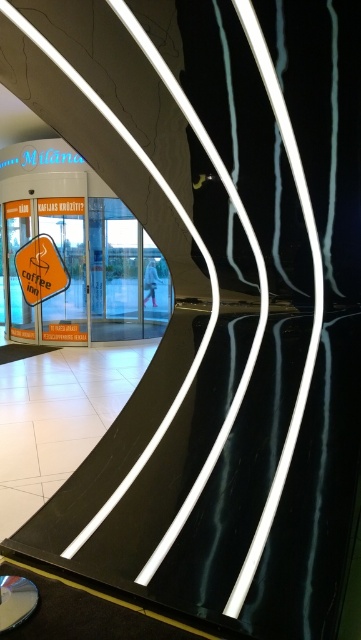
Between orange plastic sign at center and orange matte coffee sign at left, which one appears on the left side from the viewer's perspective?

orange matte coffee sign at left is more to the left.

Locate an element on the screen. The width and height of the screenshot is (361, 640). orange plastic sign at center is located at coordinates (57, 259).